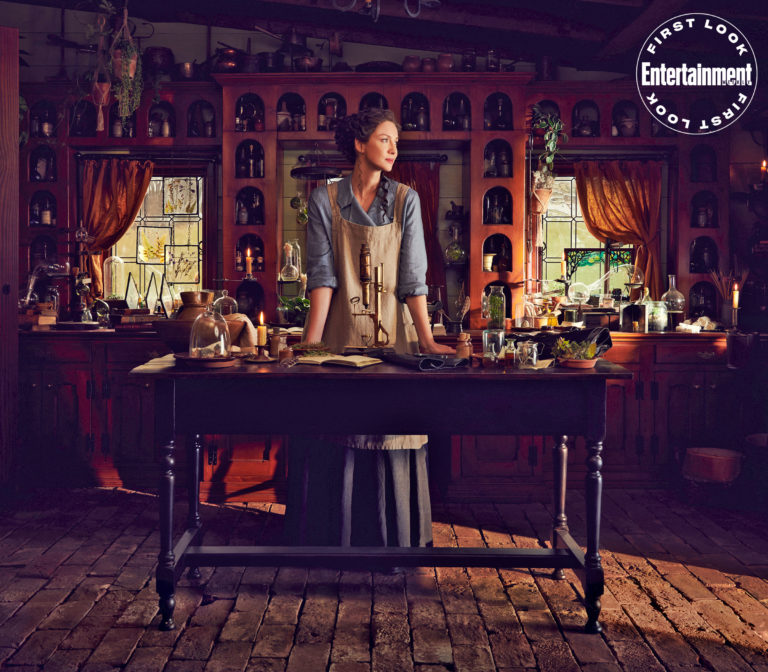
This screenshot has width=768, height=672. Find the location of `curtains`. curtains is located at coordinates (118, 201), (629, 204).